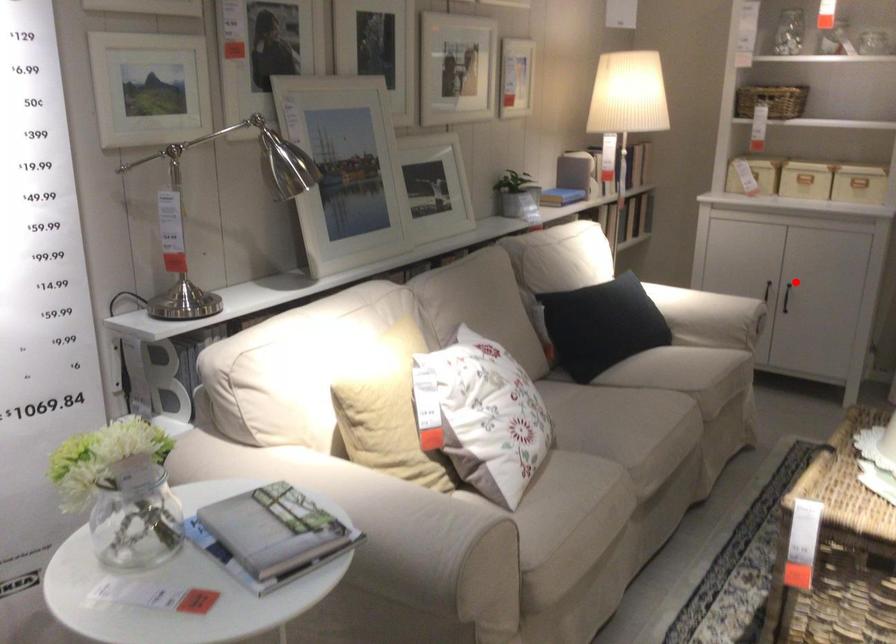
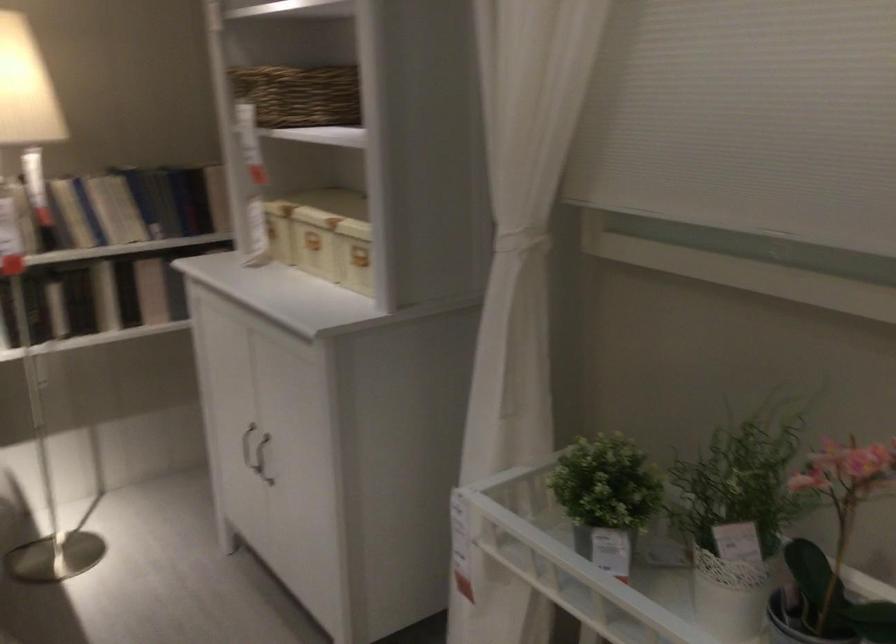
Question: I am providing you with two images of the same scene from different viewpoints. A red point is marked on the first image. Can you still see the location of the red point in image 2?

Choices:
 (A) Yes
 (B) No

Answer: (A)